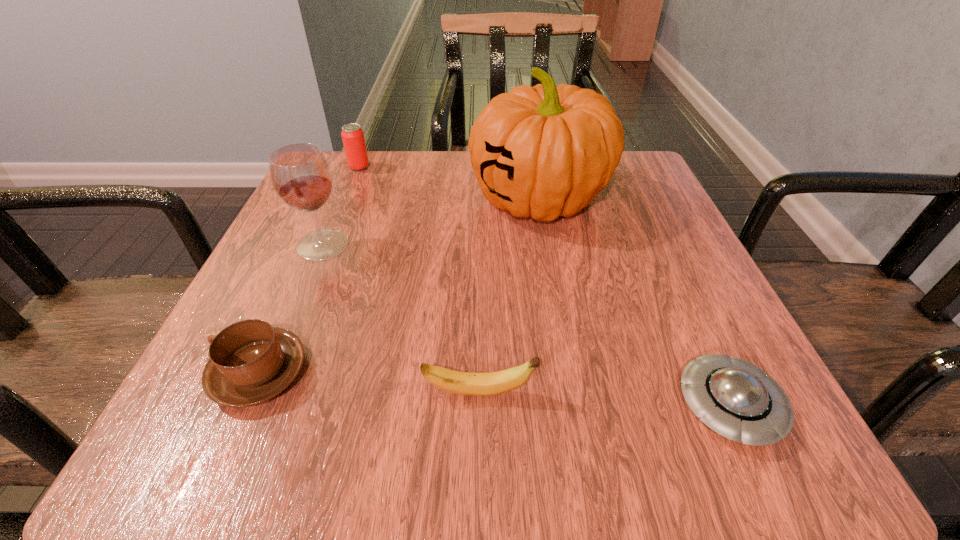
Where is `vacant space located 0.190m on the right of the third tallest object`? vacant space located 0.190m on the right of the third tallest object is located at coordinates (455, 167).

You are a GUI agent. You are given a task and a screenshot of the screen. Output one action in this format:
    pyautogui.click(x=<x>, y=<y>)
    Task: Click on the vacant space positioned at the stem of the banana
    The image size is (960, 540).
    Given the screenshot: What is the action you would take?
    pyautogui.click(x=614, y=393)

This screenshot has height=540, width=960. Find the location of `vacant area situated on the left of the saucer`. vacant area situated on the left of the saucer is located at coordinates (372, 406).

You are a GUI agent. You are given a task and a screenshot of the screen. Output one action in this format:
    pyautogui.click(x=<x>, y=<y>)
    Task: Click on the pumpkin at the far edge
    The image size is (960, 540).
    Given the screenshot: What is the action you would take?
    pyautogui.click(x=544, y=151)

At what (x,y) coordinates should I click in order to perform the action: click on beer can that is positioned at the far edge. Please return your answer as a coordinate pair (x, y). Image resolution: width=960 pixels, height=540 pixels. Looking at the image, I should click on (353, 139).

At what (x,y) coordinates should I click in order to perform the action: click on banana that is at the near edge. Please return your answer as a coordinate pair (x, y). The height and width of the screenshot is (540, 960). Looking at the image, I should click on (464, 383).

The width and height of the screenshot is (960, 540). Identify the location of cappuccino positioned at the near edge. (250, 362).

Identify the location of saucer that is at the near edge. This screenshot has width=960, height=540. (x=738, y=400).

Where is `wineglass positioned at the left edge`? wineglass positioned at the left edge is located at coordinates 301,176.

Where is `beer can that is positioned at the left edge`? beer can that is positioned at the left edge is located at coordinates (353, 139).